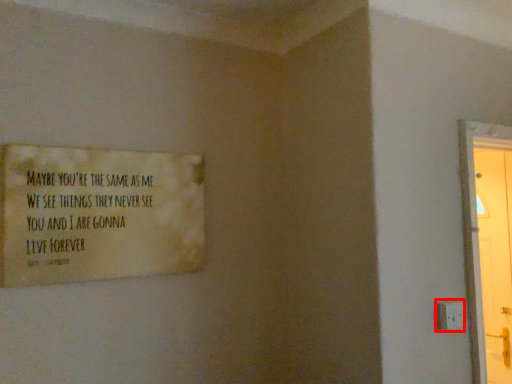
Question: Observing the image, what is the correct spatial positioning of electric outlet (annotated by the red box) in reference to poster?

Choices:
 (A) right
 (B) left

Answer: (A)